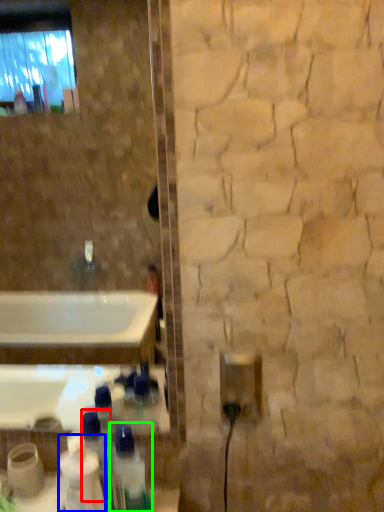
Question: Based on their relative distances, which object is nearer to bottle (highlighted by a red box)? Choose from cleaning product (highlighted by a blue box) and bottle (highlighted by a green box).

Choices:
 (A) cleaning product
 (B) bottle

Answer: (A)